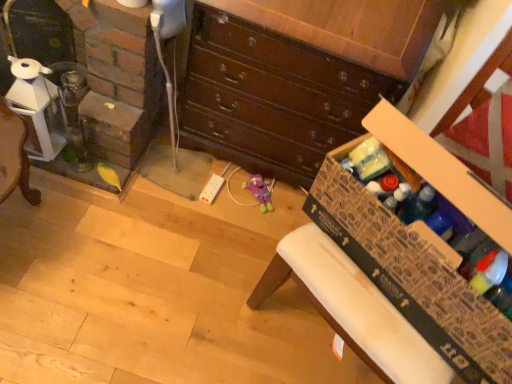
Question: Considering the relative sizes of cardboard box at lower right and wooden chest of drawers at center in the image provided, is cardboard box at lower right shorter than wooden chest of drawers at center?

Choices:
 (A) no
 (B) yes

Answer: (B)

Question: Is cardboard box at lower right closer to the viewer compared to wooden chest of drawers at center?

Choices:
 (A) no
 (B) yes

Answer: (B)

Question: Considering the relative sizes of cardboard box at lower right and wooden chest of drawers at center in the image provided, is cardboard box at lower right taller than wooden chest of drawers at center?

Choices:
 (A) no
 (B) yes

Answer: (A)

Question: From the image's perspective, is cardboard box at lower right under wooden chest of drawers at center?

Choices:
 (A) yes
 (B) no

Answer: (A)

Question: Is cardboard box at lower right next to wooden chest of drawers at center?

Choices:
 (A) no
 (B) yes

Answer: (A)

Question: Is wooden chest of drawers at center inside the boundaries of clear glass fireplace at left, or outside?

Choices:
 (A) outside
 (B) inside

Answer: (A)

Question: Is wooden chest of drawers at center to the left or to the right of clear glass fireplace at left in the image?

Choices:
 (A) right
 (B) left

Answer: (A)

Question: Considering the positions of wooden chest of drawers at center and clear glass fireplace at left in the image, is wooden chest of drawers at center wider or thinner than clear glass fireplace at left?

Choices:
 (A) thin
 (B) wide

Answer: (A)

Question: Considering the positions of wooden chest of drawers at center and clear glass fireplace at left in the image, is wooden chest of drawers at center bigger or smaller than clear glass fireplace at left?

Choices:
 (A) big
 (B) small

Answer: (B)

Question: Considering the positions of cardboard box at lower right and clear glass fireplace at left in the image, is cardboard box at lower right taller or shorter than clear glass fireplace at left?

Choices:
 (A) tall
 (B) short

Answer: (B)

Question: In terms of width, does cardboard box at lower right look wider or thinner when compared to clear glass fireplace at left?

Choices:
 (A) wide
 (B) thin

Answer: (B)

Question: In the image, is cardboard box at lower right positioned in front of or behind clear glass fireplace at left?

Choices:
 (A) behind
 (B) front

Answer: (B)

Question: From the image's perspective, is cardboard box at lower right located above or below clear glass fireplace at left?

Choices:
 (A) above
 (B) below

Answer: (B)

Question: From their relative heights in the image, would you say cardboard box at lower right is taller or shorter than wooden chest of drawers at center?

Choices:
 (A) tall
 (B) short

Answer: (B)

Question: From the image's perspective, is cardboard box at lower right positioned above or below wooden chest of drawers at center?

Choices:
 (A) below
 (B) above

Answer: (A)